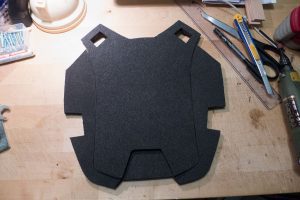
The width and height of the screenshot is (300, 200). I want to click on paperwork, so click(x=212, y=0).